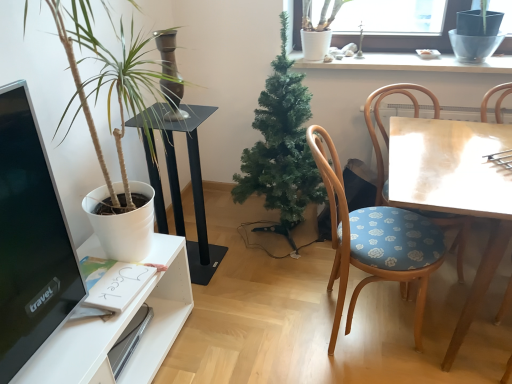
Identify the location of vacant space that is in between black glass table at center and green artificial tree at center, positioned as the 2th houseplant in left-to-right order. (243, 258).